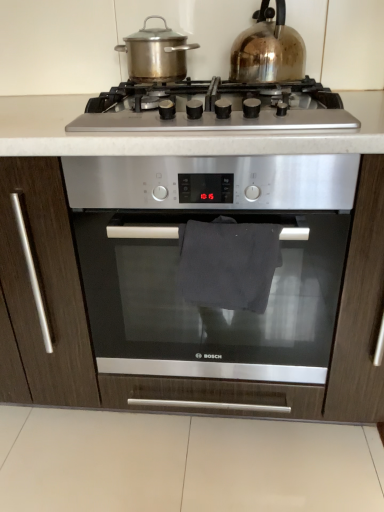
Question: Based on their sizes in the image, would you say satin silver gas stove at center is bigger or smaller than stainless steel pot at upper center, placed as the first kitchen appliance when sorted from left to right?

Choices:
 (A) big
 (B) small

Answer: (A)

Question: Looking at their shapes, would you say satin silver gas stove at center is wider or thinner than stainless steel pot at upper center, placed as the first kitchen appliance when sorted from left to right?

Choices:
 (A) thin
 (B) wide

Answer: (B)

Question: Estimate the real-world distances between objects in this image. Which object is closer to the satin silver gas stove at center?

Choices:
 (A) stainless steel pot at upper center, which is counted as the second kitchen appliance, starting from the right
 (B) satin silver oven at center
 (C) shiny metallic kettle at upper right, the 2th kitchen appliance when ordered from left to right
 (D) dark fabric towel at center

Answer: (C)

Question: Which of these objects is positioned farthest from the satin silver oven at center?

Choices:
 (A) shiny metallic kettle at upper right, the 2th kitchen appliance when ordered from left to right
 (B) stainless steel pot at upper center, which is counted as the second kitchen appliance, starting from the right
 (C) dark fabric towel at center
 (D) satin silver gas stove at center

Answer: (B)